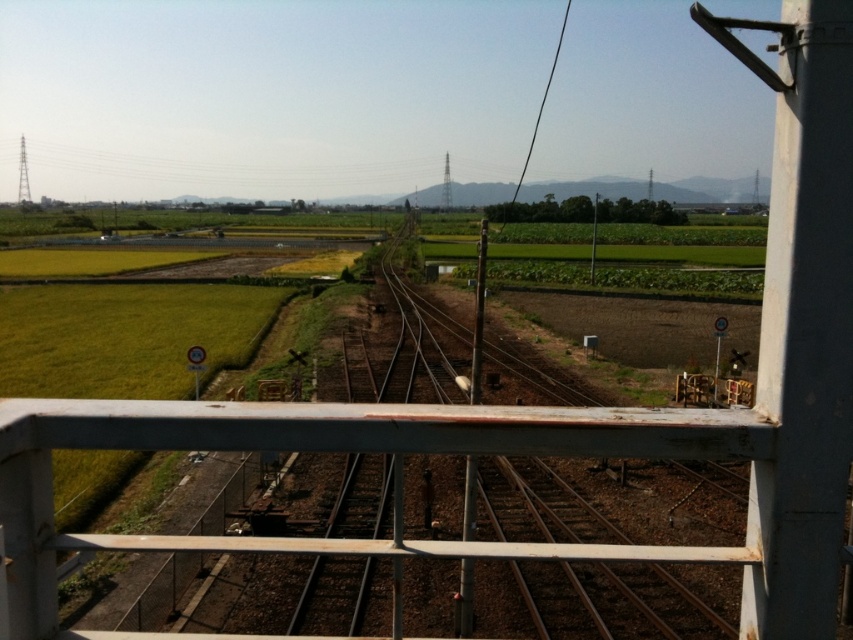
Is metallic pole at center positioned behind black wire at upper center?

No.

Between point (466, 563) and point (532, 141), which one is positioned in front?

Positioned in front is point (466, 563).

The height and width of the screenshot is (640, 853). I want to click on metallic pole at center, so click(x=479, y=317).